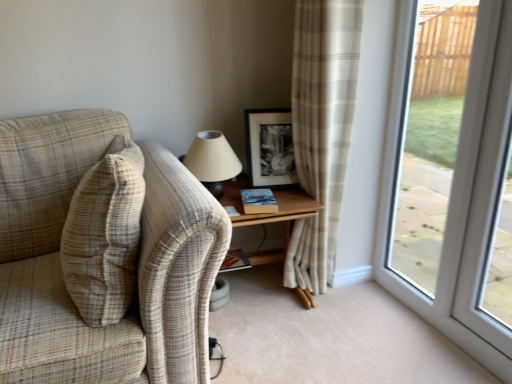
Find the location of `free space to the right of wooden table at center`. free space to the right of wooden table at center is located at coordinates (361, 316).